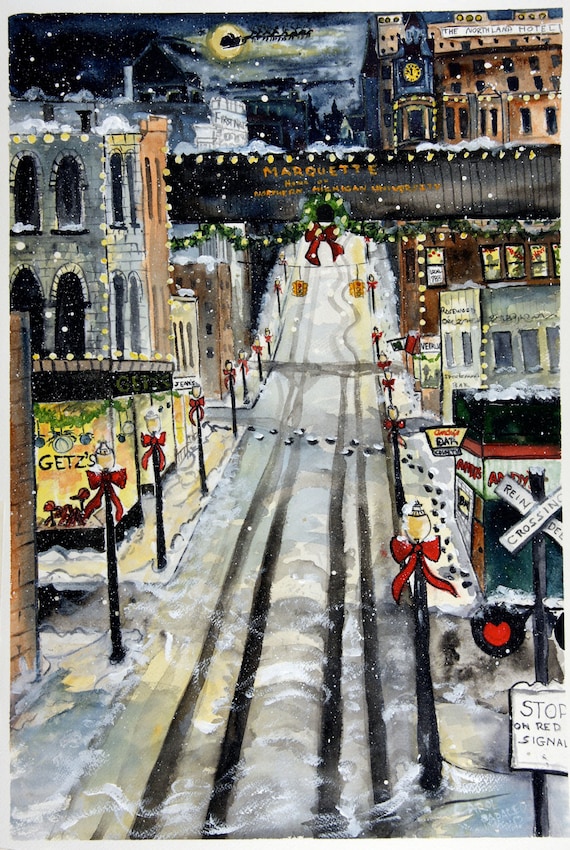
Identify the location of clock. (411, 72).